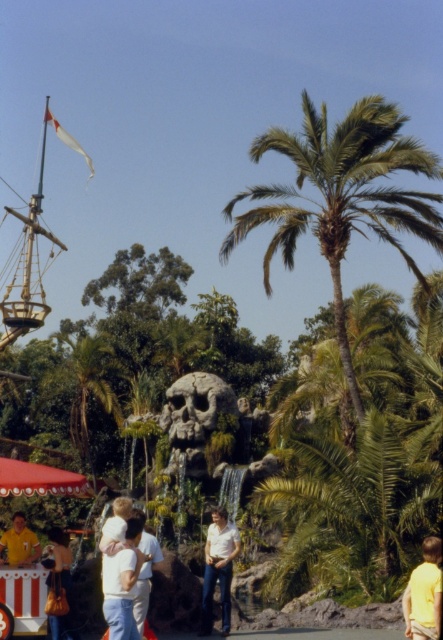
You are a photographer setting up a shot in this pirate theme park scene. You need to position two shirts for a photo. The shirts are the white cotton shirt at lower left and the matte white shirt at lower left. According to the scene, which shirt is positioned to the right of the other?

The white cotton shirt at lower left is positioned to the right of the matte white shirt at lower left.